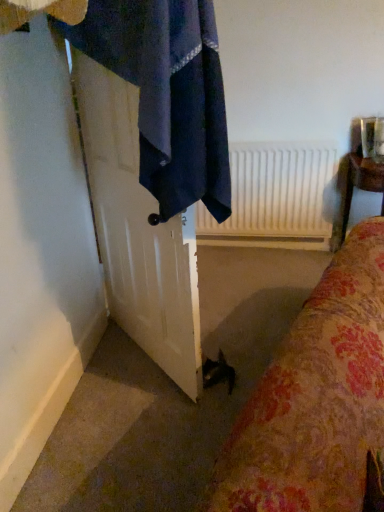
Question: Is white matte radiator at upper center in front of or behind white glossy door at left in the image?

Choices:
 (A) front
 (B) behind

Answer: (B)

Question: From the image's perspective, is white matte radiator at upper center above or below white glossy door at left?

Choices:
 (A) below
 (B) above

Answer: (B)

Question: Considering the real-world distances, which object is closest to the white matte radiator at upper center?

Choices:
 (A) white glossy door at left
 (B) wooden chair at right
 (C) dark blue fabric towel at upper left

Answer: (B)

Question: Considering the real-world distances, which object is closest to the dark blue fabric towel at upper left?

Choices:
 (A) white matte radiator at upper center
 (B) white glossy door at left
 (C) wooden chair at right

Answer: (B)